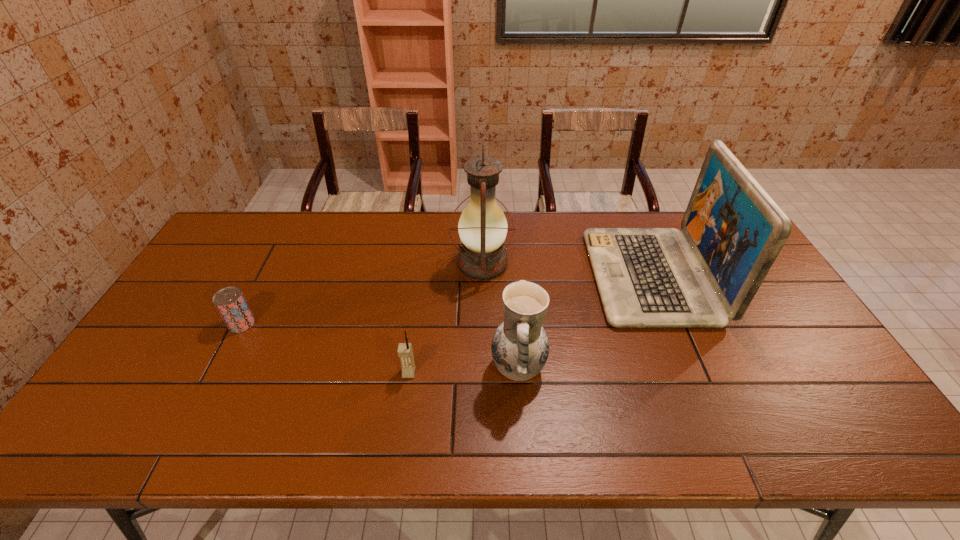
The width and height of the screenshot is (960, 540). What are the coordinates of `vacant space at the near edge of the desktop` in the screenshot? It's located at (567, 421).

In the image, there is a desktop. Identify the location of vacant space at the left edge. Image resolution: width=960 pixels, height=540 pixels. (162, 398).

This screenshot has height=540, width=960. Find the location of `vacant area at the right edge`. vacant area at the right edge is located at coordinates (793, 323).

What are the coordinates of `vacant space at the far left corner` in the screenshot? It's located at (248, 213).

Image resolution: width=960 pixels, height=540 pixels. What are the coordinates of `free spot between the shortest object and the laptop computer` in the screenshot? It's located at (446, 300).

The width and height of the screenshot is (960, 540). In order to click on vacant space that is in between the rightmost object and the pottery in this screenshot , I will do `click(585, 322)`.

At what (x,y) coordinates should I click in order to perform the action: click on vacant point located between the oil lamp and the shortest object. Please return your answer as a coordinate pair (x, y). This screenshot has height=540, width=960. Looking at the image, I should click on (362, 293).

This screenshot has width=960, height=540. I want to click on vacant area that lies between the second object from left to right and the oil lamp, so click(x=445, y=318).

At what (x,y) coordinates should I click in order to perform the action: click on free area in between the second tallest object and the oil lamp. Please return your answer as a coordinate pair (x, y). This screenshot has width=960, height=540. Looking at the image, I should click on (566, 269).

The image size is (960, 540). I want to click on free space that is in between the pottery and the rightmost object, so click(585, 322).